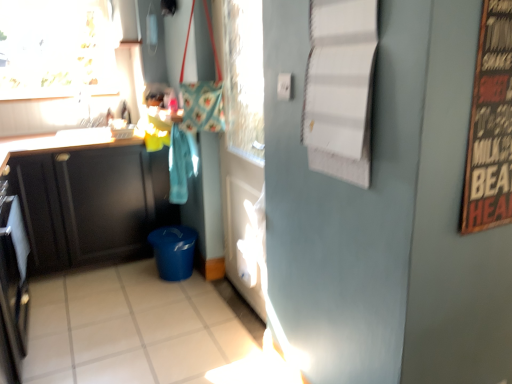
What do you see at coordinates (92, 204) in the screenshot? The width and height of the screenshot is (512, 384). I see `matte black cabinet at left, which appears as the 2th cabinetry when viewed from the front` at bounding box center [92, 204].

In order to face wooden signboard at right, should I rotate leftwards or rightwards?

You should rotate right by 29.957 degrees.

What do you see at coordinates (244, 146) in the screenshot? This screenshot has width=512, height=384. I see `white glossy door at center` at bounding box center [244, 146].

What are the coordinates of `black matte countertop at left` in the screenshot? It's located at (61, 144).

This screenshot has height=384, width=512. I want to click on matte black cabinet at left, the second cabinetry viewed from the back, so click(x=89, y=200).

Describe the element at coordinates (56, 49) in the screenshot. I see `transparent glass window at upper left` at that location.

This screenshot has width=512, height=384. Find the location of `matte black cabinet at left, which appears as the 2th cabinetry when viewed from the front`. matte black cabinet at left, which appears as the 2th cabinetry when viewed from the front is located at coordinates [x=92, y=204].

Considering the positions of objects matte black cabinet at left, which appears as the 2th cabinetry when viewed from the front, and black stainless steel oven at left in the image provided, who is in front, matte black cabinet at left, which appears as the 2th cabinetry when viewed from the front, or black stainless steel oven at left?

black stainless steel oven at left.

From the image's perspective, relative to black stainless steel oven at left, is matte black cabinet at left, which appears as the 2th cabinetry when viewed from the front, above or below?

From the image's perspective, matte black cabinet at left, which appears as the 2th cabinetry when viewed from the front, appears above black stainless steel oven at left.

Looking at this image, does matte black cabinet at left, which appears as the 2th cabinetry when viewed from the front, turn towards black stainless steel oven at left?

Yes, matte black cabinet at left, which appears as the 2th cabinetry when viewed from the front, is oriented towards black stainless steel oven at left.

Which of these two, matte black cabinet at left, which is counted as the first cabinetry, starting from the back, or black stainless steel oven at left, stands shorter?

black stainless steel oven at left.

From the image's perspective, is wooden signboard at right over matte black cabinet at left, which is counted as the first cabinetry, starting from the back?

Yes.

From a real-world perspective, between wooden signboard at right and matte black cabinet at left, which is counted as the first cabinetry, starting from the back, who is vertically higher?

From a 3D spatial view, wooden signboard at right is above.

You are a GUI agent. You are given a task and a screenshot of the screen. Output one action in this format:
    pyautogui.click(x=<x>, y=<y>)
    Task: Click on the bulletin board above the matte black cabinet at left, which is counted as the first cabinetry, starting from the back (from the image's perspective)
    The width and height of the screenshot is (512, 384).
    Given the screenshot: What is the action you would take?
    pyautogui.click(x=490, y=125)

From the image's perspective, would you say white glossy door at center is positioned over black stainless steel oven at left?

Yes, from the image's perspective, white glossy door at center is above black stainless steel oven at left.

Which object is further away from the camera, white glossy door at center or black stainless steel oven at left?

white glossy door at center.

Is white glossy door at center thinner than black stainless steel oven at left?

Correct, the width of white glossy door at center is less than that of black stainless steel oven at left.

In terms of height, does white glossy door at center look taller or shorter compared to black stainless steel oven at left?

Clearly, white glossy door at center is taller compared to black stainless steel oven at left.

Are black matte countertop at left and white glossy tile at lower center making contact?

No, black matte countertop at left is not making contact with white glossy tile at lower center.

Between black matte countertop at left and white glossy tile at lower center, which one has larger size?

white glossy tile at lower center is bigger.

Does black matte countertop at left turn towards white glossy tile at lower center?

No.

Does black matte countertop at left appear on the right side of white glossy tile at lower center?

In fact, black matte countertop at left is to the left of white glossy tile at lower center.

Looking at this image, which object is further away from the camera taking this photo, white glossy tile at lower center or matte black cabinet at left, which is counted as the first cabinetry, starting from the back?

Positioned behind is matte black cabinet at left, which is counted as the first cabinetry, starting from the back.

Would you say white glossy tile at lower center is a long distance from matte black cabinet at left, which is counted as the first cabinetry, starting from the back?

That's not correct — white glossy tile at lower center is a little close to matte black cabinet at left, which is counted as the first cabinetry, starting from the back.

Looking at this image, from the image's perspective, is white glossy tile at lower center above or below matte black cabinet at left, which is counted as the first cabinetry, starting from the back?

white glossy tile at lower center is below matte black cabinet at left, which is counted as the first cabinetry, starting from the back.

Consider the image. Does white glossy tile at lower center turn towards matte black cabinet at left, which appears as the 2th cabinetry when viewed from the front?

No, white glossy tile at lower center is not aimed at matte black cabinet at left, which appears as the 2th cabinetry when viewed from the front.

Does point (9, 151) come farther from viewer compared to point (13, 51)?

No, (9, 151) is in front of (13, 51).

From the image's perspective, is black matte countertop at left located above transparent glass window at upper left?

Incorrect, from the image's perspective, black matte countertop at left is lower than transparent glass window at upper left.

Is black matte countertop at left thinner than transparent glass window at upper left?

Incorrect, the width of black matte countertop at left is not less than that of transparent glass window at upper left.

What are the coordinates of `countertop that is on the right side of transparent glass window at upper left` in the screenshot? It's located at (61, 144).

Which object is positioned more to the left, white glossy tile at lower center or black matte countertop at left?

From the viewer's perspective, black matte countertop at left appears more on the left side.

From their relative heights in the image, would you say white glossy tile at lower center is taller or shorter than black matte countertop at left?

Clearly, white glossy tile at lower center is shorter compared to black matte countertop at left.

Is white glossy tile at lower center far from black matte countertop at left?

Yes, white glossy tile at lower center and black matte countertop at left are located far from each other.

Between point (32, 375) and point (60, 149), which one is positioned behind?

The point (60, 149) is behind.

Where is `cabinetry that is the 1st one when counting rightward from the black stainless steel oven at left`? This screenshot has width=512, height=384. cabinetry that is the 1st one when counting rightward from the black stainless steel oven at left is located at coordinates (92, 204).

The height and width of the screenshot is (384, 512). I want to click on the 2nd cabinetry to the left of the wooden signboard at right, counting from the anchor's position, so click(x=92, y=204).

Which object lies nearer to the anchor point matte black cabinet at left, which is counted as the first cabinetry, starting from the back, black matte countertop at left or transparent glass window at upper left?

black matte countertop at left is positioned closer to the anchor matte black cabinet at left, which is counted as the first cabinetry, starting from the back.

Estimate the real-world distances between objects in this image. Which object is closer to matte black cabinet at left, the first cabinetry from the front, white glossy tile at lower center or transparent glass window at upper left?

white glossy tile at lower center.

Based on their spatial positions, is matte black cabinet at left, the first cabinetry from the front, or wooden signboard at right closer to white glossy tile at lower center?

Among the two, matte black cabinet at left, the first cabinetry from the front, is located nearer to white glossy tile at lower center.

Looking at the image, which one is located closer to white glossy tile at lower center, matte black cabinet at left, the second cabinetry viewed from the back, or black matte countertop at left?

matte black cabinet at left, the second cabinetry viewed from the back, lies closer to white glossy tile at lower center than the other object.

Estimate the real-world distances between objects in this image. Which object is further from black matte countertop at left, black stainless steel oven at left or matte black cabinet at left, the second cabinetry viewed from the back?

black stainless steel oven at left.

Looking at the image, which one is located closer to matte black cabinet at left, the second cabinetry viewed from the back, matte black cabinet at left, which appears as the 2th cabinetry when viewed from the front, or black matte countertop at left?

matte black cabinet at left, which appears as the 2th cabinetry when viewed from the front, lies closer to matte black cabinet at left, the second cabinetry viewed from the back, than the other object.

Based on their spatial positions, is white glossy door at center or wooden signboard at right further from matte black cabinet at left, which is counted as the first cabinetry, starting from the back?

wooden signboard at right is positioned further to the anchor matte black cabinet at left, which is counted as the first cabinetry, starting from the back.

Estimate the real-world distances between objects in this image. Which object is further from transparent glass window at upper left, black stainless steel oven at left or white glossy door at center?

Based on the image, white glossy door at center appears to be further to transparent glass window at upper left.

Find the location of a particular element. The height and width of the screenshot is (384, 512). door that lies between transparent glass window at upper left and white glossy tile at lower center from top to bottom is located at coordinates (244, 146).

At what (x,y) coordinates should I click in order to perform the action: click on door positioned between matte black cabinet at left, the second cabinetry viewed from the back, and matte black cabinet at left, which appears as the 2th cabinetry when viewed from the front, from near to far. Please return your answer as a coordinate pair (x, y). Image resolution: width=512 pixels, height=384 pixels. Looking at the image, I should click on (244, 146).

Locate an element on the screen. The width and height of the screenshot is (512, 384). appliance between transparent glass window at upper left and white glossy tile at lower center vertically is located at coordinates (14, 278).

What are the coordinates of `tile located between matte black cabinet at left, the first cabinetry from the front, and black stainless steel oven at left in the depth direction` in the screenshot? It's located at (131, 328).